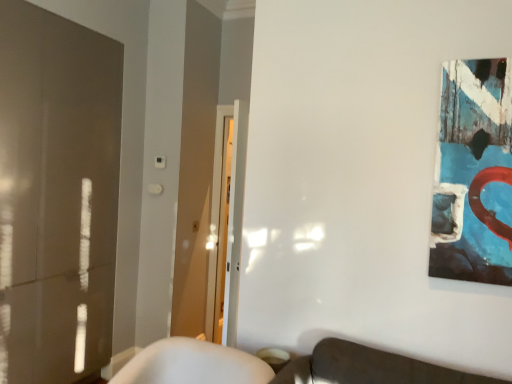
Describe the element at coordinates (56, 194) in the screenshot. I see `matte glass door at left` at that location.

This screenshot has width=512, height=384. Identify the location of matte glass door at left. (56, 194).

The width and height of the screenshot is (512, 384). What do you see at coordinates (474, 174) in the screenshot? I see `textured canvas artwork at upper right` at bounding box center [474, 174].

You are a GUI agent. You are given a task and a screenshot of the screen. Output one action in this format:
    pyautogui.click(x=<x>, y=<y>)
    Task: Click on the textured canvas artwork at upper right
    This screenshot has height=384, width=512.
    Given the screenshot: What is the action you would take?
    pyautogui.click(x=474, y=174)

Where is `matte glass door at left`? matte glass door at left is located at coordinates (56, 194).

Which object is positioned more to the right, matte glass door at left or textured canvas artwork at upper right?

textured canvas artwork at upper right is more to the right.

Relative to textured canvas artwork at upper right, is matte glass door at left in front or behind?

Visually, matte glass door at left is located behind textured canvas artwork at upper right.

Considering the points (64, 72) and (440, 139), which point is in front, point (64, 72) or point (440, 139)?

The point (440, 139) is closer to the camera.

From the image's perspective, which is below, matte glass door at left or textured canvas artwork at upper right?

matte glass door at left, from the image's perspective.

From a real-world perspective, between matte glass door at left and textured canvas artwork at upper right, who is vertically lower?

From a 3D spatial view, matte glass door at left is below.

Considering the sizes of objects matte glass door at left and textured canvas artwork at upper right in the image provided, who is wider, matte glass door at left or textured canvas artwork at upper right?

With larger width is matte glass door at left.

Can you confirm if matte glass door at left is shorter than textured canvas artwork at upper right?

No.

Who is bigger, matte glass door at left or textured canvas artwork at upper right?

matte glass door at left.

Do you think matte glass door at left is within textured canvas artwork at upper right, or outside of it?

matte glass door at left is located beyond the bounds of textured canvas artwork at upper right.

Would you consider matte glass door at left to be distant from textured canvas artwork at upper right?

Absolutely, matte glass door at left is distant from textured canvas artwork at upper right.

Does matte glass door at left turn towards textured canvas artwork at upper right?

Yes, matte glass door at left faces towards textured canvas artwork at upper right.

How much distance is there between matte glass door at left and textured canvas artwork at upper right?

They are 2.15 meters apart.

In the image, there is a matte glass door at left. Where is `picture frame above it (from the image's perspective)`? This screenshot has height=384, width=512. picture frame above it (from the image's perspective) is located at coordinates (474, 174).

Consider the image. Which is more to the right, textured canvas artwork at upper right or matte glass door at left?

textured canvas artwork at upper right.

Is textured canvas artwork at upper right in front of matte glass door at left?

Yes, it is in front of matte glass door at left.

Which is nearer, (x=503, y=192) or (x=71, y=203)?

The point (x=503, y=192) is more forward.

From the image's perspective, is textured canvas artwork at upper right located above or below matte glass door at left?

textured canvas artwork at upper right is situated higher than matte glass door at left in the image.

From a real-world perspective, does textured canvas artwork at upper right stand above matte glass door at left?

Yes, from a real-world perspective, textured canvas artwork at upper right is on top of matte glass door at left.

Is textured canvas artwork at upper right thinner than matte glass door at left?

Yes, textured canvas artwork at upper right is thinner than matte glass door at left.

Considering the sizes of objects textured canvas artwork at upper right and matte glass door at left in the image provided, who is taller, textured canvas artwork at upper right or matte glass door at left?

matte glass door at left.

In the scene shown: Which of these two, textured canvas artwork at upper right or matte glass door at left, is smaller?

textured canvas artwork at upper right is smaller.

Which is correct: textured canvas artwork at upper right is inside matte glass door at left, or outside of it?

textured canvas artwork at upper right is located beyond the bounds of matte glass door at left.

Is the surface of textured canvas artwork at upper right in direct contact with matte glass door at left?

No, textured canvas artwork at upper right is not next to matte glass door at left.

Is textured canvas artwork at upper right oriented towards matte glass door at left?

No, textured canvas artwork at upper right does not turn towards matte glass door at left.

Find the location of a particular element. Image resolution: width=512 pixels, height=384 pixels. picture frame on the right side of matte glass door at left is located at coordinates (474, 174).

Locate an element on the screen. glass door below the textured canvas artwork at upper right (from the image's perspective) is located at coordinates (56, 194).

At what (x,y) coordinates should I click in order to perform the action: click on glass door beneath the textured canvas artwork at upper right (from a real-world perspective). Please return your answer as a coordinate pair (x, y). This screenshot has width=512, height=384. Looking at the image, I should click on (56, 194).